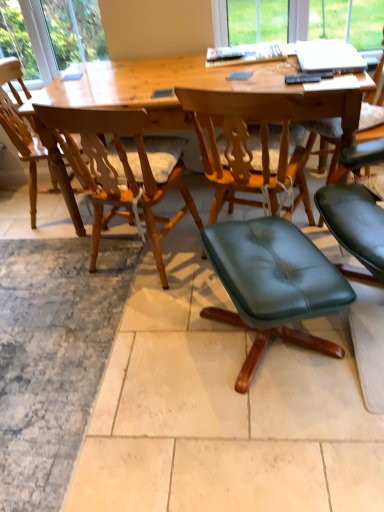
Identify the location of wooden desk at center. (201, 90).

What do you see at coordinates (123, 170) in the screenshot? I see `wooden chair at center, which is the second chair from left to right` at bounding box center [123, 170].

What is the approximate width of wooden chair at center, acting as the 3th chair starting from the right?

The width of wooden chair at center, acting as the 3th chair starting from the right, is 24.85 inches.

The width and height of the screenshot is (384, 512). Describe the element at coordinates (22, 130) in the screenshot. I see `light wood chair at center, the 4th chair from the right` at that location.

Describe the element at coordinates (273, 284) in the screenshot. This screenshot has width=384, height=512. I see `green leather ottoman at lower right, the 3th chair when ordered from left to right` at that location.

What is the approximate height of green leather ottoman at lower right, the 3th chair when ordered from left to right?

green leather ottoman at lower right, the 3th chair when ordered from left to right, is 17.34 inches in height.

Where is `wooden desk at center`? This screenshot has width=384, height=512. wooden desk at center is located at coordinates (201, 90).

Looking at this image, how different are the orientations of light wood chair at center, which is the 1th chair from left to right, and green leather ottoman at lower right, the 3th chair when ordered from left to right, in degrees?

The angle between the facing direction of light wood chair at center, which is the 1th chair from left to right, and the facing direction of green leather ottoman at lower right, the 3th chair when ordered from left to right, is 156 degrees.

Which is more to the right, light wood chair at center, the 4th chair from the right, or green leather ottoman at lower right, the 3th chair when ordered from left to right?

green leather ottoman at lower right, the 3th chair when ordered from left to right.

Is light wood chair at center, the 4th chair from the right, aimed at green leather ottoman at lower right, the 3th chair when ordered from left to right?

No, light wood chair at center, the 4th chair from the right, is not oriented towards green leather ottoman at lower right, the 3th chair when ordered from left to right.

Is light wood chair at center, which is the 1th chair from left to right, not close to green leather ottoman at lower right, marked as the 2th chair in a right-to-left arrangement?

Yes, light wood chair at center, which is the 1th chair from left to right, is far from green leather ottoman at lower right, marked as the 2th chair in a right-to-left arrangement.

Does green leather ottoman at lower right, marked as the 2th chair in a right-to-left arrangement, have a lesser width compared to wooden desk at center?

Yes.

Considering the sizes of green leather ottoman at lower right, marked as the 2th chair in a right-to-left arrangement, and wooden desk at center in the image, is green leather ottoman at lower right, marked as the 2th chair in a right-to-left arrangement, taller or shorter than wooden desk at center?

Considering their sizes, green leather ottoman at lower right, marked as the 2th chair in a right-to-left arrangement, has less height than wooden desk at center.

Relative to wooden desk at center, is green leather ottoman at lower right, the 3th chair when ordered from left to right, in front or behind?

Clearly, green leather ottoman at lower right, the 3th chair when ordered from left to right, is in front of wooden desk at center.

From a real-world perspective, is green leather ottoman at lower right, marked as the 2th chair in a right-to-left arrangement, over wooden desk at center?

No, from a real-world perspective, green leather ottoman at lower right, marked as the 2th chair in a right-to-left arrangement, is not above wooden desk at center.

From a real-world perspective, who is located lower, green leather ottoman at lower right, marked as the 2th chair in a right-to-left arrangement, or wooden chair at center, which is the second chair from left to right?

green leather ottoman at lower right, marked as the 2th chair in a right-to-left arrangement.

Does point (252, 290) lie behind point (79, 118)?

No, it is in front of (79, 118).

How distant is green leather ottoman at lower right, marked as the 2th chair in a right-to-left arrangement, from wooden chair at center, which is the second chair from left to right?

green leather ottoman at lower right, marked as the 2th chair in a right-to-left arrangement, and wooden chair at center, which is the second chair from left to right, are 24.10 inches apart.

Is light wood chair at center, the 4th chair from the right, not within green leather ottoman at center, placed as the 4th chair when sorted from left to right?

Yes.

From the image's perspective, is light wood chair at center, which is the 1th chair from left to right, under green leather ottoman at center, placed as the 1th chair when sorted from right to left?

No, from the image's perspective, light wood chair at center, which is the 1th chair from left to right, is not below green leather ottoman at center, placed as the 1th chair when sorted from right to left.

Can you confirm if light wood chair at center, the 4th chair from the right, is positioned to the right of green leather ottoman at center, placed as the 1th chair when sorted from right to left?

No, light wood chair at center, the 4th chair from the right, is not to the right of green leather ottoman at center, placed as the 1th chair when sorted from right to left.

Between light wood chair at center, which is the 1th chair from left to right, and green leather ottoman at center, placed as the 1th chair when sorted from right to left, which one is positioned behind?

Positioned behind is light wood chair at center, which is the 1th chair from left to right.

Looking at this image, is green leather ottoman at center, placed as the 4th chair when sorted from left to right, bigger than wooden desk at center?

No, green leather ottoman at center, placed as the 4th chair when sorted from left to right, is not bigger than wooden desk at center.

Between point (209, 106) and point (362, 85), which one is positioned in front?

The point (209, 106) is in front.

Considering the relative positions of green leather ottoman at center, placed as the 1th chair when sorted from right to left, and wooden desk at center in the image provided, is green leather ottoman at center, placed as the 1th chair when sorted from right to left, to the left of wooden desk at center from the viewer's perspective?

Incorrect, green leather ottoman at center, placed as the 1th chair when sorted from right to left, is not on the left side of wooden desk at center.

Is green leather ottoman at center, placed as the 4th chair when sorted from left to right, oriented away from wooden desk at center?

Yes, green leather ottoman at center, placed as the 4th chair when sorted from left to right, is facing away from wooden desk at center.

Between wooden chair at center, which is the second chair from left to right, and green leather ottoman at lower right, the 3th chair when ordered from left to right, which one appears on the right side from the viewer's perspective?

green leather ottoman at lower right, the 3th chair when ordered from left to right.

Is wooden chair at center, which is the second chair from left to right, next to green leather ottoman at lower right, the 3th chair when ordered from left to right, and touching it?

No, wooden chair at center, which is the second chair from left to right, is not next to green leather ottoman at lower right, the 3th chair when ordered from left to right.

From the wooden chair at center, which is the second chair from left to right, count 1st chair to the right and point to it. Please provide its 2D coordinates.

[(273, 284)]

Looking at this image, which point is more distant from viewer, [185,196] or [212,261]?

The point [185,196] is behind.

Is wooden chair at center, which is the second chair from left to right, at the back of wooden desk at center?

That's right, wooden desk at center is facing away from wooden chair at center, which is the second chair from left to right.

From a real-world perspective, is wooden desk at center below wooden chair at center, acting as the 3th chair starting from the right?

Yes, from a real-world perspective, wooden desk at center is below wooden chair at center, acting as the 3th chair starting from the right.

Is wooden desk at center completely or partially outside of wooden chair at center, which is the second chair from left to right?

That's correct, wooden desk at center is outside of wooden chair at center, which is the second chair from left to right.

Locate an element on the screen. This screenshot has width=384, height=512. chair that is the 2nd object directly below the light wood chair at center, which is the 1th chair from left to right (from a real-world perspective) is located at coordinates coord(273,284).

Identify the location of desk above the green leather ottoman at lower right, the 3th chair when ordered from left to right (from a real-world perspective). Image resolution: width=384 pixels, height=512 pixels. (201, 90).

From the picture: Looking at the image, which one is located further to green leather ottoman at center, placed as the 4th chair when sorted from left to right, green leather ottoman at lower right, marked as the 2th chair in a right-to-left arrangement, or wooden chair at center, which is the second chair from left to right?

green leather ottoman at lower right, marked as the 2th chair in a right-to-left arrangement.

Considering their positions, is wooden chair at center, acting as the 3th chair starting from the right, positioned closer to green leather ottoman at lower right, the 3th chair when ordered from left to right, than wooden desk at center?

wooden chair at center, acting as the 3th chair starting from the right, is closer to green leather ottoman at lower right, the 3th chair when ordered from left to right.

When comparing their distances from wooden chair at center, acting as the 3th chair starting from the right, does wooden desk at center or green leather ottoman at lower right, marked as the 2th chair in a right-to-left arrangement, seem closer?

The object closer to wooden chair at center, acting as the 3th chair starting from the right, is wooden desk at center.

When comparing their distances from wooden desk at center, does light wood chair at center, the 4th chair from the right, or green leather ottoman at lower right, the 3th chair when ordered from left to right, seem closer?

Among the two, light wood chair at center, the 4th chair from the right, is located nearer to wooden desk at center.

From the image, which object appears to be nearer to light wood chair at center, the 4th chair from the right, wooden chair at center, acting as the 3th chair starting from the right, or green leather ottoman at lower right, marked as the 2th chair in a right-to-left arrangement?

Among the two, wooden chair at center, acting as the 3th chair starting from the right, is located nearer to light wood chair at center, the 4th chair from the right.

From the image, which object appears to be farther from wooden chair at center, which is the second chair from left to right, green leather ottoman at lower right, the 3th chair when ordered from left to right, or green leather ottoman at center, placed as the 4th chair when sorted from left to right?

green leather ottoman at lower right, the 3th chair when ordered from left to right, lies further to wooden chair at center, which is the second chair from left to right, than the other object.

Estimate the real-world distances between objects in this image. Which object is further from green leather ottoman at center, placed as the 4th chair when sorted from left to right, light wood chair at center, the 4th chair from the right, or green leather ottoman at lower right, the 3th chair when ordered from left to right?

The object further to green leather ottoman at center, placed as the 4th chair when sorted from left to right, is light wood chair at center, the 4th chair from the right.

Considering their positions, is light wood chair at center, the 4th chair from the right, positioned closer to wooden desk at center than wooden chair at center, acting as the 3th chair starting from the right?

Based on the image, wooden chair at center, acting as the 3th chair starting from the right, appears to be nearer to wooden desk at center.

In order to click on desk situated between wooden chair at center, which is the second chair from left to right, and green leather ottoman at center, placed as the 1th chair when sorted from right to left, from left to right in this screenshot , I will do `click(201, 90)`.

Where is `desk situated between light wood chair at center, which is the 1th chair from left to right, and green leather ottoman at lower right, marked as the 2th chair in a right-to-left arrangement, from left to right`? The height and width of the screenshot is (512, 384). desk situated between light wood chair at center, which is the 1th chair from left to right, and green leather ottoman at lower right, marked as the 2th chair in a right-to-left arrangement, from left to right is located at coordinates (201, 90).

You are a GUI agent. You are given a task and a screenshot of the screen. Output one action in this format:
    pyautogui.click(x=<x>, y=<y>)
    Task: Click on the chair between wooden chair at center, acting as the 3th chair starting from the right, and green leather ottoman at center, placed as the 1th chair when sorted from right to left, from left to right
    
    Given the screenshot: What is the action you would take?
    pyautogui.click(x=273, y=284)

You are a GUI agent. You are given a task and a screenshot of the screen. Output one action in this format:
    pyautogui.click(x=<x>, y=<y>)
    Task: Click on the chair located between light wood chair at center, the 4th chair from the right, and green leather ottoman at lower right, marked as the 2th chair in a right-to-left arrangement, in the left-right direction
    
    Given the screenshot: What is the action you would take?
    pyautogui.click(x=123, y=170)